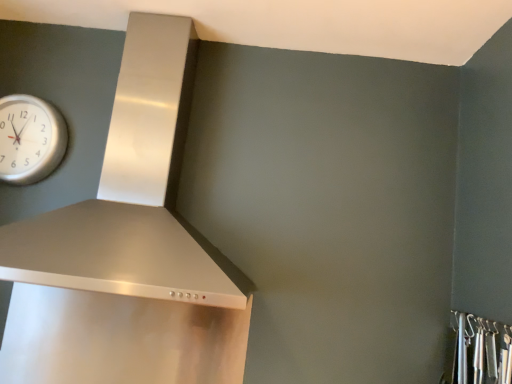
Question: Is satin silver vent at upper left turned away from metallic silver hooks at lower right?

Choices:
 (A) no
 (B) yes

Answer: (A)

Question: Is satin silver vent at upper left at the right side of metallic silver hooks at lower right?

Choices:
 (A) no
 (B) yes

Answer: (A)

Question: Is satin silver vent at upper left not close to metallic silver hooks at lower right?

Choices:
 (A) yes
 (B) no

Answer: (A)

Question: From the image's perspective, is satin silver vent at upper left under metallic silver hooks at lower right?

Choices:
 (A) yes
 (B) no

Answer: (B)

Question: Can you confirm if satin silver vent at upper left is smaller than metallic silver hooks at lower right?

Choices:
 (A) yes
 (B) no

Answer: (B)

Question: Is metallic silver hooks at lower right bigger or smaller than silver metallic clock at upper left?

Choices:
 (A) big
 (B) small

Answer: (B)

Question: Is metallic silver hooks at lower right inside or outside of silver metallic clock at upper left?

Choices:
 (A) inside
 (B) outside

Answer: (B)

Question: From the image's perspective, is metallic silver hooks at lower right above or below silver metallic clock at upper left?

Choices:
 (A) above
 (B) below

Answer: (B)

Question: Looking at their shapes, would you say metallic silver hooks at lower right is wider or thinner than silver metallic clock at upper left?

Choices:
 (A) thin
 (B) wide

Answer: (A)

Question: In terms of width, does silver metallic clock at upper left look wider or thinner when compared to metallic silver hooks at lower right?

Choices:
 (A) wide
 (B) thin

Answer: (A)

Question: Based on their sizes in the image, would you say silver metallic clock at upper left is bigger or smaller than metallic silver hooks at lower right?

Choices:
 (A) small
 (B) big

Answer: (B)

Question: Does point (2, 152) appear closer or farther from the camera than point (462, 377)?

Choices:
 (A) farther
 (B) closer

Answer: (A)

Question: Which is correct: silver metallic clock at upper left is inside metallic silver hooks at lower right, or outside of it?

Choices:
 (A) outside
 (B) inside

Answer: (A)

Question: Based on their positions, is metallic silver hooks at lower right located to the left or right of satin silver vent at upper left?

Choices:
 (A) right
 (B) left

Answer: (A)

Question: From a real-world perspective, relative to satin silver vent at upper left, is metallic silver hooks at lower right vertically above or below?

Choices:
 (A) below
 (B) above

Answer: (A)